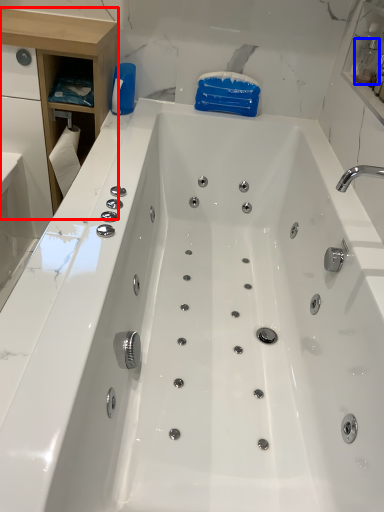
Question: Which object appears closest to the camera in this image, cabinetry (highlighted by a red box) or bottle (highlighted by a blue box)?

Choices:
 (A) cabinetry
 (B) bottle

Answer: (A)